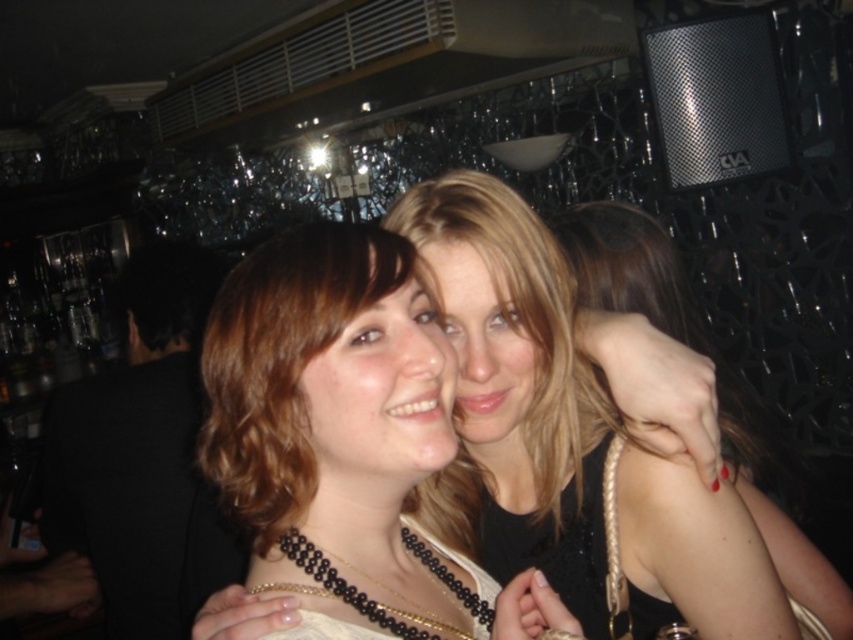
Between smooth blonde hair at center and blonde hair at center, which one appears on the right side from the viewer's perspective?

From the viewer's perspective, smooth blonde hair at center appears more on the right side.

Is smooth blonde hair at center further to camera compared to blonde hair at center?

Yes, it is.

Is point (654, 538) in front of point (310, 248)?

No, it is behind (310, 248).

Locate an element on the screen. The height and width of the screenshot is (640, 853). smooth blonde hair at center is located at coordinates (573, 438).

Between blonde hair at center and black beaded necklace at center, which one appears on the left side from the viewer's perspective?

blonde hair at center is more to the left.

Is point (245, 426) closer to viewer compared to point (289, 541)?

Yes, it is in front of point (289, 541).

Locate an element on the screen. blonde hair at center is located at coordinates (282, 362).

Is smooth blonde hair at center bigger than black beaded necklace at center?

Correct, smooth blonde hair at center is larger in size than black beaded necklace at center.

Locate an element on the screen. The height and width of the screenshot is (640, 853). smooth blonde hair at center is located at coordinates (573, 438).